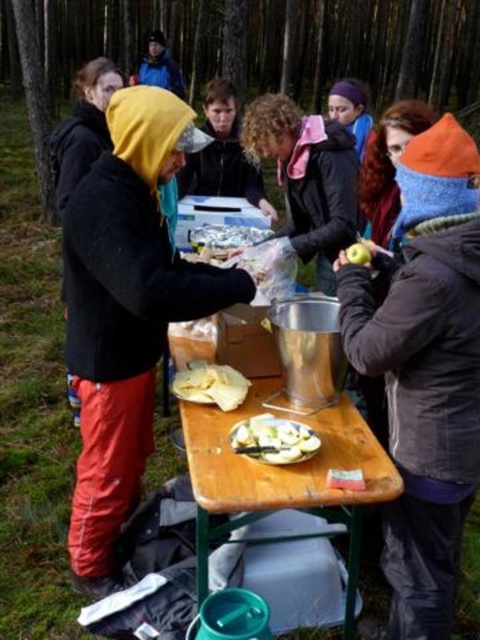
Question: Among these points, which one is nearest to the camera?

Choices:
 (A) (383, 467)
 (B) (232, 228)

Answer: (A)

Question: Is white matte plate at center positioned behind white crumbly bread at center?

Choices:
 (A) no
 (B) yes

Answer: (A)

Question: Estimate the real-world distances between objects in this image. Which object is closer to the orange knit hat at upper right?

Choices:
 (A) white matte plate at center
 (B) green matte apple at upper center
 (C) white plastic bag at center
 (D) matte black hoodie at left

Answer: (B)

Question: Among these points, which one is farthest from the camera?

Choices:
 (A) (358, 259)
 (B) (193, 230)
 (C) (451, 486)
 (D) (163, 68)

Answer: (D)

Question: Does wooden table at center have a lesser width compared to white matte plate at center?

Choices:
 (A) no
 (B) yes

Answer: (A)

Question: Does curly-haired person at center have a lesser width compared to blue jacket at upper center?

Choices:
 (A) no
 (B) yes

Answer: (B)